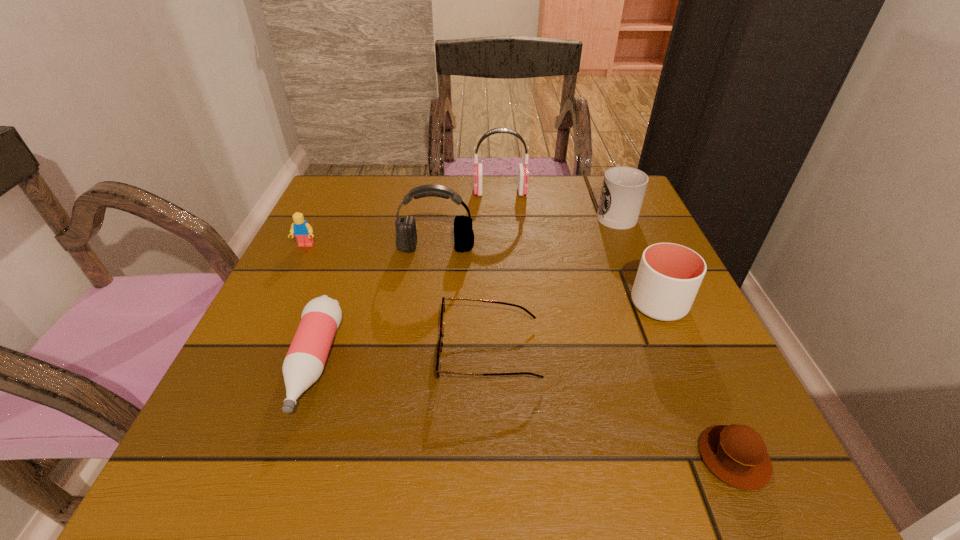
At what (x,y) coordinates should I click in order to perform the action: click on earphone located at the far edge. Please return your answer as a coordinate pair (x, y). The height and width of the screenshot is (540, 960). Looking at the image, I should click on (523, 174).

Locate an element on the screen. Image resolution: width=960 pixels, height=540 pixels. cup located at the far edge is located at coordinates (623, 190).

Where is `object that is at the near edge`? The height and width of the screenshot is (540, 960). object that is at the near edge is located at coordinates (736, 454).

Identify the location of Lego that is at the left edge. The width and height of the screenshot is (960, 540). pos(300,228).

Locate an element on the screen. bottle at the left edge is located at coordinates (305, 360).

Find the location of a particular element. muffin positioned at the right edge is located at coordinates (736, 454).

The height and width of the screenshot is (540, 960). Find the location of `object located in the far right corner section of the desktop`. object located in the far right corner section of the desktop is located at coordinates (623, 190).

The width and height of the screenshot is (960, 540). Find the location of `object present at the near right corner`. object present at the near right corner is located at coordinates (736, 454).

At what (x,y) coordinates should I click in order to perform the action: click on free space at the far edge of the desktop. Please return your answer as a coordinate pair (x, y). Looking at the image, I should click on (462, 188).

The height and width of the screenshot is (540, 960). What are the coordinates of `free space at the near edge` in the screenshot? It's located at (578, 491).